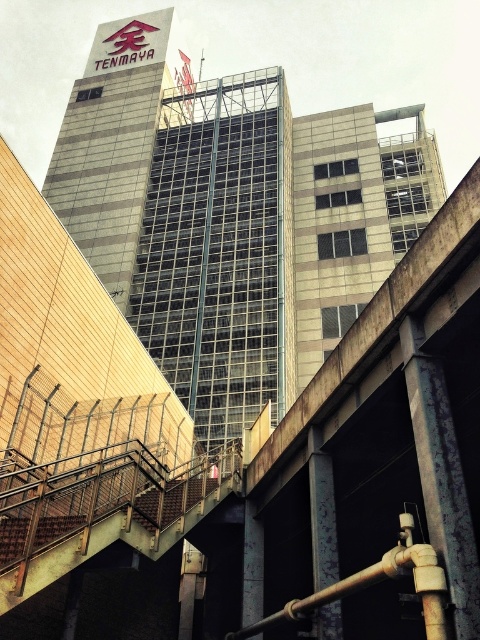
You are standing on the pedestrian bridge in front of the TENMAYA building. You notice two points marked on the bridge. One is at coordinate point (91, 250) and the other at point (148, 504). Which point is closer to you as you face the building?

Point (148, 504) is closer to you because it is in front of point (91, 250).

You are a city planner assessing the view from a new park being built. The park will have a viewing area that faces the gray glass building at upper center and the brown wooden stairs at lower center. Since the park is designed to prioritize the view of the larger structure, which object should be emphasized in the design?

The gray glass building at upper center should be emphasized because its width is larger than the brown wooden stairs at lower center, making it the more prominent structure in the view.

You are a delivery person carrying a large box that is 2 meters wide. You need to move from the brown wooden stairs at lower center to the concrete bridge at center. Can you pass through the area between them?

The concrete bridge at center is wider than the brown wooden stairs at lower center. Since the box is 2 meters wide, you need to check the minimum width between the two structures. If the narrowest point is at least 2 meters, you can pass. However, since the bridge is wider, the stairs might be the limiting factor. Without exact measurements, it is uncertain.